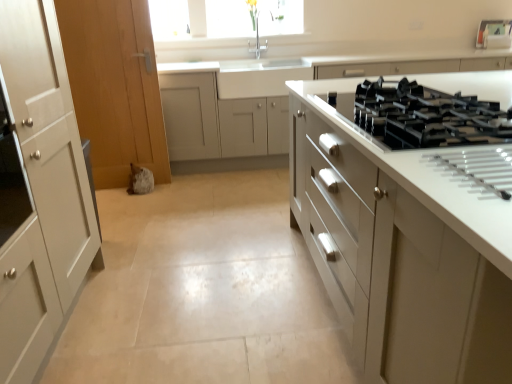
Question: Is the depth of white glossy cabinet at right, the first cabinetry viewed from the front, greater than that of black glass gas stove at right?

Choices:
 (A) yes
 (B) no

Answer: (B)

Question: Does white glossy cabinet at right, the second cabinetry viewed from the back, appear on the left side of black glass gas stove at right?

Choices:
 (A) yes
 (B) no

Answer: (B)

Question: Is white glossy cabinet at right, the first cabinetry viewed from the front, completely or partially outside of black glass gas stove at right?

Choices:
 (A) yes
 (B) no

Answer: (A)

Question: Does white glossy cabinet at right, the first cabinetry viewed from the front, lie in front of black glass gas stove at right?

Choices:
 (A) yes
 (B) no

Answer: (A)

Question: From the image's perspective, is white glossy cabinet at right, the first cabinetry viewed from the front, below black glass gas stove at right?

Choices:
 (A) yes
 (B) no

Answer: (A)

Question: Is white glossy cabinet at right, the first cabinetry viewed from the front, facing away from black glass gas stove at right?

Choices:
 (A) no
 (B) yes

Answer: (A)

Question: Is white glossy cabinet at right, the second cabinetry viewed from the back, facing towards white glossy cabinetry at center, which is the second cabinetry in front-to-back order?

Choices:
 (A) yes
 (B) no

Answer: (B)

Question: Does white glossy cabinet at right, the second cabinetry viewed from the back, contain white glossy cabinetry at center, the first cabinetry in the back-to-front sequence?

Choices:
 (A) no
 (B) yes

Answer: (A)

Question: Is white glossy cabinet at right, the second cabinetry viewed from the back, positioned beyond the bounds of white glossy cabinetry at center, the first cabinetry in the back-to-front sequence?

Choices:
 (A) yes
 (B) no

Answer: (A)

Question: Is white glossy cabinet at right, the second cabinetry viewed from the back, thinner than white glossy cabinetry at center, the first cabinetry in the back-to-front sequence?

Choices:
 (A) yes
 (B) no

Answer: (B)

Question: From the image's perspective, is white glossy cabinet at right, the second cabinetry viewed from the back, beneath white glossy cabinetry at center, which is the second cabinetry in front-to-back order?

Choices:
 (A) yes
 (B) no

Answer: (A)

Question: Considering the relative positions of white glossy cabinet at right, the first cabinetry viewed from the front, and white glossy cabinetry at center, which is the second cabinetry in front-to-back order, in the image provided, is white glossy cabinet at right, the first cabinetry viewed from the front, to the right of white glossy cabinetry at center, which is the second cabinetry in front-to-back order, from the viewer's perspective?

Choices:
 (A) yes
 (B) no

Answer: (A)

Question: Is the surface of black glass gas stove at right in direct contact with white glossy cabinet at right, the first cabinetry viewed from the front?

Choices:
 (A) yes
 (B) no

Answer: (B)